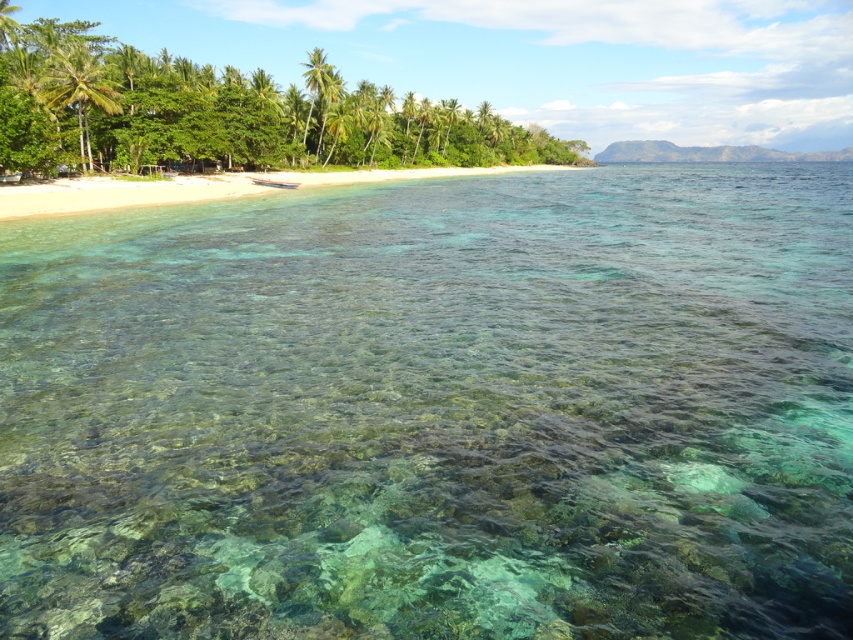
You are standing on the beach and want to take a photo of both the clear water at center and the green leafy palm tree at center. Which object will appear taller in the photo?

The green leafy palm tree at center will appear taller in the photo because it has a greater height compared to the clear water at center.

You are a photographer planning to capture the clear water at center and the green leafy palm tree at center in a single frame. Which object will appear larger in the photo?

The green leafy palm tree at center will appear larger in the photo because it is bigger than the clear water at center.